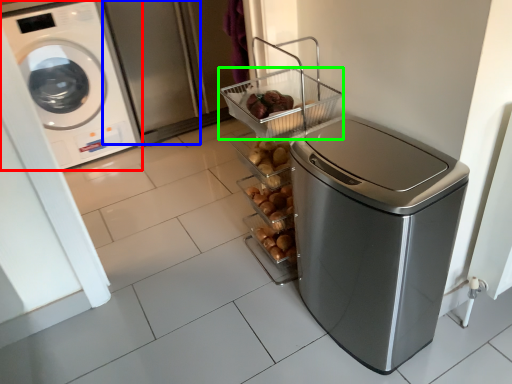
Question: Considering the real-world distances, which object is farthest from washing machine (highlighted by a red box)? screen door (highlighted by a blue box) or basket (highlighted by a green box)?

Choices:
 (A) screen door
 (B) basket

Answer: (B)